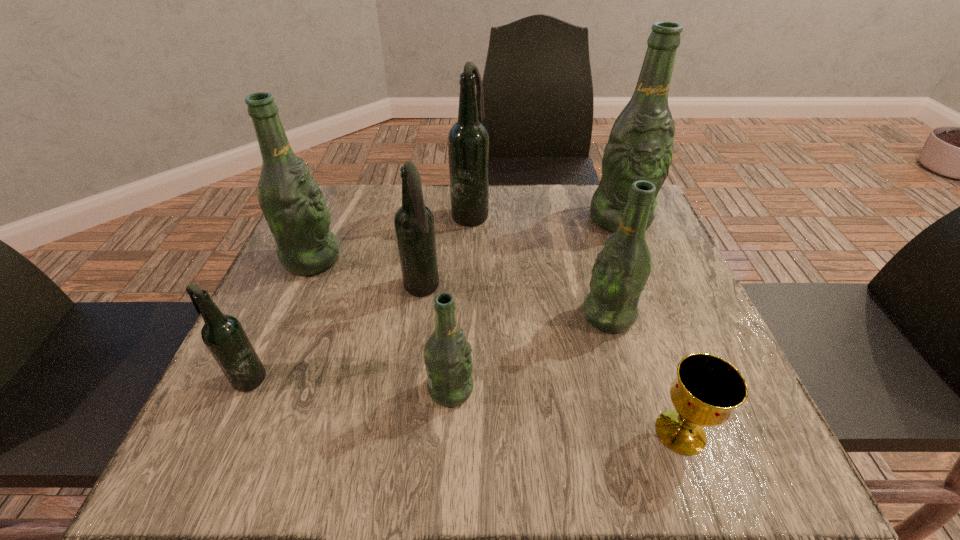
Where is `vacant region between the rightmost dark beer bottle and the shortest object`? The height and width of the screenshot is (540, 960). vacant region between the rightmost dark beer bottle and the shortest object is located at coordinates (575, 323).

This screenshot has width=960, height=540. Find the location of `free area in between the smallest dark beer bottle and the second smallest dark beer bottle`. free area in between the smallest dark beer bottle and the second smallest dark beer bottle is located at coordinates (334, 334).

I want to click on free space between the leftmost green beer bottle and the third green beer bottle from right to left, so click(381, 324).

Where is `free point between the second farthest green beer bottle and the rightmost dark beer bottle`? This screenshot has height=540, width=960. free point between the second farthest green beer bottle and the rightmost dark beer bottle is located at coordinates (391, 236).

Where is `vacant region between the second dark beer bottle from left to right and the second smallest green beer bottle`? The image size is (960, 540). vacant region between the second dark beer bottle from left to right and the second smallest green beer bottle is located at coordinates (515, 302).

Find the location of a particular element. The height and width of the screenshot is (540, 960). free spot between the third smallest green beer bottle and the shortest object is located at coordinates (496, 346).

Locate which object ranks seventh in proximity to the tallest object. Please provide its 2D coordinates. Your answer should be formatted as a tuple, i.e. [(x, y)], where the tuple contains the x and y coordinates of a point satisfying the conditions above.

[(224, 336)]

Identify which object is the sixth nearest to the gold chalice. Please provide its 2D coordinates. Your answer should be formatted as a tuple, i.e. [(x, y)], where the tuple contains the x and y coordinates of a point satisfying the conditions above.

[(224, 336)]

This screenshot has width=960, height=540. Find the location of `the third closest beer bottle to the smallest dark beer bottle`. the third closest beer bottle to the smallest dark beer bottle is located at coordinates (447, 354).

You are a GUI agent. You are given a task and a screenshot of the screen. Output one action in this format:
    pyautogui.click(x=<x>, y=<y>)
    Task: Click on the beer bottle that is the second closest to the biggest dark beer bottle
    This screenshot has height=540, width=960.
    Given the screenshot: What is the action you would take?
    pyautogui.click(x=292, y=203)